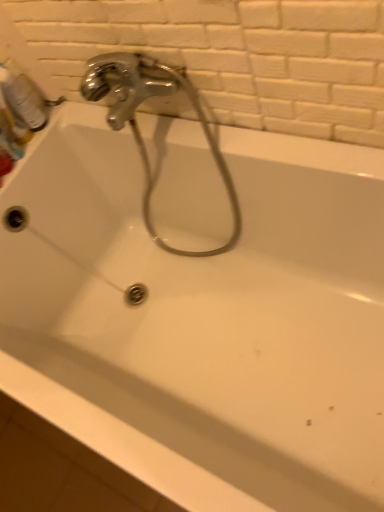
Question: Can you confirm if chrome metallic faucet at upper left is wider than translucent plastic mouthwash at upper left?

Choices:
 (A) no
 (B) yes

Answer: (B)

Question: Can you confirm if chrome metallic faucet at upper left is taller than translucent plastic mouthwash at upper left?

Choices:
 (A) yes
 (B) no

Answer: (A)

Question: Is chrome metallic faucet at upper left facing away from translucent plastic mouthwash at upper left?

Choices:
 (A) yes
 (B) no

Answer: (B)

Question: Could you tell me if chrome metallic faucet at upper left is facing translucent plastic mouthwash at upper left?

Choices:
 (A) no
 (B) yes

Answer: (A)

Question: Is chrome metallic faucet at upper left bigger than translucent plastic mouthwash at upper left?

Choices:
 (A) no
 (B) yes

Answer: (B)

Question: Is chrome metallic faucet at upper left at the right side of translucent plastic mouthwash at upper left?

Choices:
 (A) yes
 (B) no

Answer: (A)

Question: From the image's perspective, is translucent plastic mouthwash at upper left over chrome metallic faucet at upper left?

Choices:
 (A) no
 (B) yes

Answer: (B)

Question: Is translucent plastic mouthwash at upper left at the right side of chrome metallic faucet at upper left?

Choices:
 (A) yes
 (B) no

Answer: (B)

Question: Is translucent plastic mouthwash at upper left further to the viewer compared to chrome metallic faucet at upper left?

Choices:
 (A) no
 (B) yes

Answer: (B)

Question: From a real-world perspective, is translucent plastic mouthwash at upper left located beneath chrome metallic faucet at upper left?

Choices:
 (A) yes
 (B) no

Answer: (B)

Question: Is translucent plastic mouthwash at upper left oriented away from chrome metallic faucet at upper left?

Choices:
 (A) yes
 (B) no

Answer: (B)

Question: Does translucent plastic mouthwash at upper left have a greater height compared to chrome metallic faucet at upper left?

Choices:
 (A) no
 (B) yes

Answer: (A)

Question: Would you say translucent plastic mouthwash at upper left is to the left or to the right of chrome metallic faucet at upper left in the picture?

Choices:
 (A) right
 (B) left

Answer: (B)